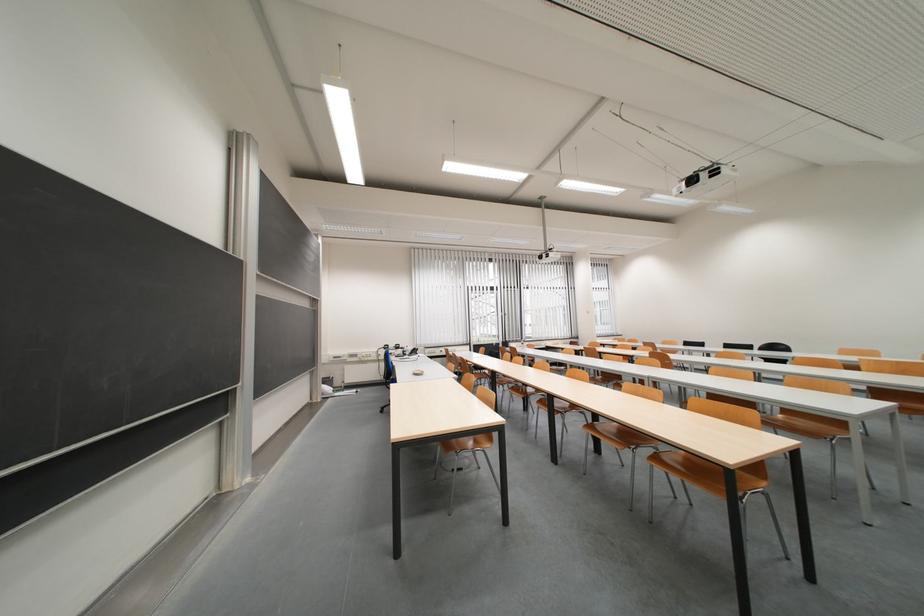
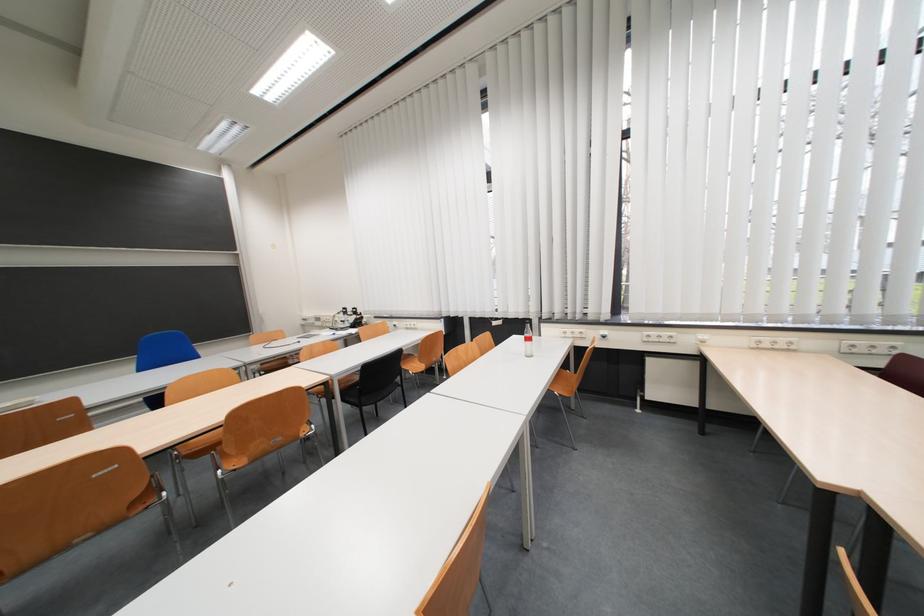
Where in the second image is the point corresponding to [398,351] from the first image?

(357, 315)